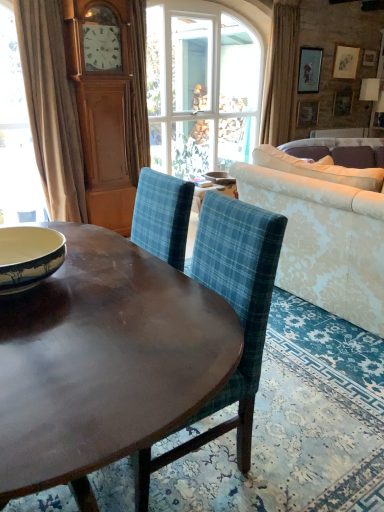
Locate an element on the screen. vacant location behind blue and white ceramic bowl at left, which ranks as the 1th bowl in bottom-to-top order is located at coordinates (87, 247).